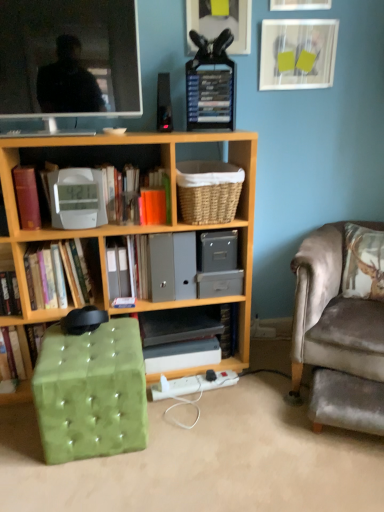
Question: Can you confirm if hardcover books at upper center, positioned as the 3th paperback book in left-to-right order, is positioned to the right of white plastic charger at lower center?

Choices:
 (A) yes
 (B) no

Answer: (A)

Question: Is hardcover books at upper center, the third paperback book in the bottom-to-top sequence, to the left of white plastic charger at lower center from the viewer's perspective?

Choices:
 (A) no
 (B) yes

Answer: (A)

Question: Does hardcover books at upper center, the first paperback book from the right, have a lesser height compared to white plastic charger at lower center?

Choices:
 (A) yes
 (B) no

Answer: (B)

Question: From a real-world perspective, is hardcover books at upper center, positioned as the 3th paperback book in left-to-right order, physically below white plastic charger at lower center?

Choices:
 (A) yes
 (B) no

Answer: (B)

Question: Considering the relative sizes of hardcover books at upper center, the 1th paperback book positioned from the top, and white plastic charger at lower center in the image provided, is hardcover books at upper center, the 1th paperback book positioned from the top, wider than white plastic charger at lower center?

Choices:
 (A) yes
 (B) no

Answer: (A)

Question: Is hardcover books at upper center, positioned as the 3th paperback book in left-to-right order, thinner than white plastic charger at lower center?

Choices:
 (A) no
 (B) yes

Answer: (A)

Question: From a real-world perspective, is matte white picture frame at upper center, arranged as the 2th picture frame when viewed from the left, on orange matte paper at upper center, positioned as the second paperback book in right-to-left order?

Choices:
 (A) yes
 (B) no

Answer: (A)

Question: Can you confirm if matte white picture frame at upper center, acting as the 2th picture frame starting from the right, is shorter than orange matte paper at upper center, which is the third paperback book in top-to-bottom order?

Choices:
 (A) yes
 (B) no

Answer: (B)

Question: Is matte white picture frame at upper center, arranged as the 2th picture frame when viewed from the left, taller than orange matte paper at upper center, positioned as the second paperback book in right-to-left order?

Choices:
 (A) no
 (B) yes

Answer: (B)

Question: Is matte white picture frame at upper center, arranged as the 2th picture frame when viewed from the left, to the left of orange matte paper at upper center, positioned as the second paperback book in right-to-left order, from the viewer's perspective?

Choices:
 (A) no
 (B) yes

Answer: (A)

Question: Is the depth of matte white picture frame at upper center, acting as the 2th picture frame starting from the right, greater than that of orange matte paper at upper center, the first paperback book when ordered from bottom to top?

Choices:
 (A) no
 (B) yes

Answer: (A)

Question: From the image's perspective, is matte white picture frame at upper center, arranged as the 2th picture frame when viewed from the left, on orange matte paper at upper center, which is the third paperback book in top-to-bottom order?

Choices:
 (A) yes
 (B) no

Answer: (A)

Question: Does matte white picture frame at upper center, acting as the 2th picture frame starting from the right, have a smaller size compared to hardcover books at upper center, the third paperback book in the bottom-to-top sequence?

Choices:
 (A) yes
 (B) no

Answer: (A)